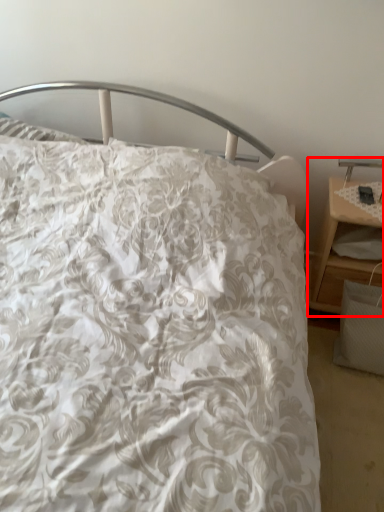
Question: Considering the relative positions of nightstand (annotated by the red box) and table lamp in the image provided, where is nightstand (annotated by the red box) located with respect to the staircase?

Choices:
 (A) left
 (B) right

Answer: (A)